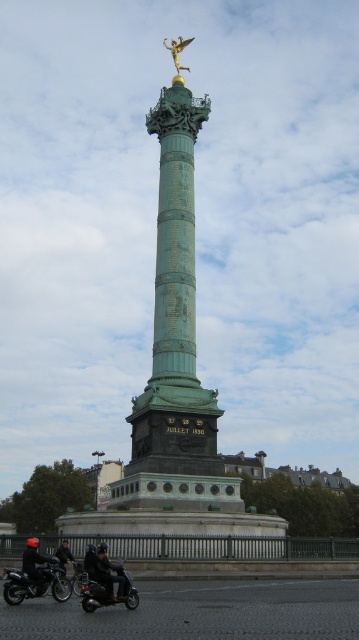
Is green patina column at center wider than shiny black motorcycle at lower left?

Indeed, green patina column at center has a greater width compared to shiny black motorcycle at lower left.

Is point (169, 371) farther from viewer compared to point (30, 586)?

That is True.

Which is behind, point (164, 182) or point (44, 564)?

The point (164, 182) is more distant.

Find the location of `green patina column at center`. green patina column at center is located at coordinates (174, 378).

Does shiny black scooter at lower left have a greater width compared to black leather jacket at lower left?

In fact, shiny black scooter at lower left might be narrower than black leather jacket at lower left.

Identify the location of shiny black scooter at lower left. The image size is (359, 640). (106, 593).

I want to click on shiny black scooter at lower left, so click(106, 593).

Looking at this image, which is above, shiny black scooter at lower left or gold metallic angel at upper center?

gold metallic angel at upper center

What do you see at coordinates (106, 593) in the screenshot?
I see `shiny black scooter at lower left` at bounding box center [106, 593].

Where is `shiny black scooter at lower left`? The height and width of the screenshot is (640, 359). shiny black scooter at lower left is located at coordinates (106, 593).